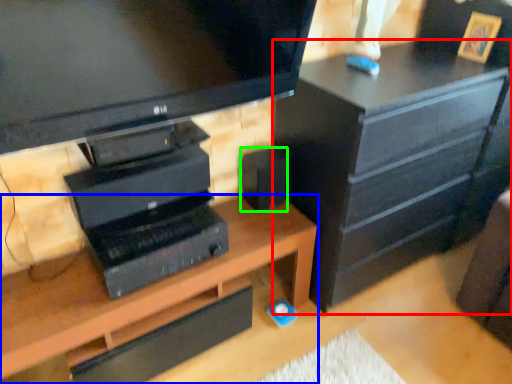
Question: Estimate the real-world distances between objects in this image. Which object is closer to chest of drawers (highlighted by a red box), desk (highlighted by a blue box) or speaker (highlighted by a green box)?

Choices:
 (A) desk
 (B) speaker

Answer: (B)